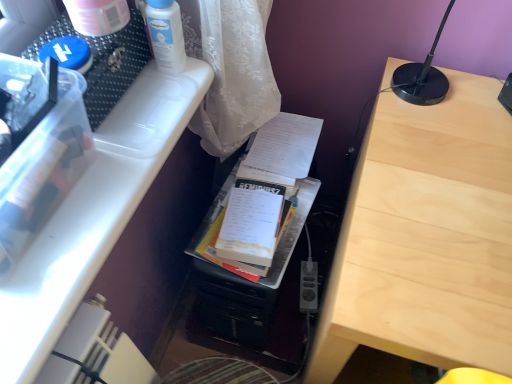
Measure the distance between point (57, 237) and camera.

Point (57, 237) and camera are 55.40 centimeters apart from each other.

Locate an element on the screen. white glossy lotion at upper center is located at coordinates (166, 35).

The image size is (512, 384). Find the location of `light wood table at center`. light wood table at center is located at coordinates coord(426,237).

Is white paper at center turned away from white glossy lotion at upper center?

That's not correct — white paper at center is not looking away from white glossy lotion at upper center.

Where is `bottle to the left of white paper at center`? This screenshot has width=512, height=384. bottle to the left of white paper at center is located at coordinates point(166,35).

Is white glossy lotion at upper center surrounded by white paper at center?

No, white glossy lotion at upper center is not a part of white paper at center.

Considering the sizes of objects white paper at center and white glossy lotion at upper center in the image provided, who is bigger, white paper at center or white glossy lotion at upper center?

With larger size is white glossy lotion at upper center.

In the scene shown: Which is closer to the camera, (x=23, y=330) or (x=294, y=142)?

Point (x=23, y=330).

Does white plastic container at upper left contain white paper at center?

Answer: No.

From the image's perspective, which one is positioned higher, white plastic container at upper left or white paper at center?

white paper at center.

Looking at this image, is white glossy lotion at upper center bigger than white plastic container at upper left?

No.

Considering the relative sizes of white glossy lotion at upper center and white plastic container at upper left in the image provided, is white glossy lotion at upper center shorter than white plastic container at upper left?

Incorrect, the height of white glossy lotion at upper center does not fall short of that of white plastic container at upper left.

Does white glossy lotion at upper center lie behind white plastic container at upper left?

That is True.

Is white glossy lotion at upper center oriented away from white plastic container at upper left?

No, white glossy lotion at upper center is not facing away from white plastic container at upper left.

Consider the image. Is white plastic container at upper left placed right next to white glossy lotion at upper center?

No, white plastic container at upper left is not beside white glossy lotion at upper center.

Where is `desk located below the white glossy lotion at upper center (from the image's perspective)`? The height and width of the screenshot is (384, 512). desk located below the white glossy lotion at upper center (from the image's perspective) is located at coordinates (93, 215).

Who is more distant, white plastic container at upper left or white glossy lotion at upper center?

white glossy lotion at upper center.

Is white plastic container at upper left looking in the opposite direction of white glossy lotion at upper center?

No, white plastic container at upper left's orientation is not away from white glossy lotion at upper center.

Would you say white paper at center is a long distance from light wood table at center?

No, white paper at center is in close proximity to light wood table at center.

Is white paper at center at the left side of light wood table at center?

Yes.

Relative to light wood table at center, is white paper at center in front or behind?

Visually, white paper at center is located behind light wood table at center.

Considering the relative sizes of white paper at center and light wood table at center in the image provided, is white paper at center taller than light wood table at center?

No, white paper at center is not taller than light wood table at center.

Is black plastic power plugs and sockets at lower center positioned far away from white glossy lotion at upper center?

No, black plastic power plugs and sockets at lower center is not far away from white glossy lotion at upper center.

Does black plastic power plugs and sockets at lower center have a larger size compared to white glossy lotion at upper center?

Incorrect, black plastic power plugs and sockets at lower center is not larger than white glossy lotion at upper center.

Considering the sizes of black plastic power plugs and sockets at lower center and white glossy lotion at upper center in the image, is black plastic power plugs and sockets at lower center taller or shorter than white glossy lotion at upper center?

Considering their sizes, black plastic power plugs and sockets at lower center has less height than white glossy lotion at upper center.

Can you tell me how much black plastic power plugs and sockets at lower center and white glossy lotion at upper center differ in facing direction?

The angular difference between black plastic power plugs and sockets at lower center and white glossy lotion at upper center is 77.9 degrees.

Can you tell me how much white paper at center and white plastic container at upper left differ in facing direction?

86.9 degrees separate the facing orientations of white paper at center and white plastic container at upper left.

Considering the sizes of objects white paper at center and white plastic container at upper left in the image provided, who is bigger, white paper at center or white plastic container at upper left?

white plastic container at upper left is bigger.

Is the depth of white paper at center greater than that of white plastic container at upper left?

Yes, white paper at center is behind white plastic container at upper left.

Considering the positions of point (296, 168) and point (59, 298), is point (296, 168) closer or farther from the camera than point (59, 298)?

Point (296, 168) is farther from the camera than point (59, 298).

Locate an element on the screen. document on the right of the white glossy lotion at upper center is located at coordinates (285, 146).

Where is `desk that appears above the white paper at center (from a real-world perspective)`? Image resolution: width=512 pixels, height=384 pixels. desk that appears above the white paper at center (from a real-world perspective) is located at coordinates (93, 215).

From the image, which object appears to be nearer to black plastic power plugs and sockets at lower center, white plastic container at upper left or white glossy lotion at upper center?

white plastic container at upper left lies closer to black plastic power plugs and sockets at lower center than the other object.

When comparing their distances from black plastic power plugs and sockets at lower center, does white glossy lotion at upper center or light wood table at center seem further?

Among the two, white glossy lotion at upper center is located further to black plastic power plugs and sockets at lower center.

Considering their positions, is white plastic container at upper left positioned closer to white paper at center than white glossy lotion at upper center?

Based on the image, white glossy lotion at upper center appears to be nearer to white paper at center.

Considering their positions, is black plastic power plugs and sockets at lower center positioned closer to white paper at center than white plastic container at upper left?

Among the two, white plastic container at upper left is located nearer to white paper at center.

When comparing their distances from white glossy lotion at upper center, does white plastic container at upper left or white paper at center seem further?

white paper at center is further to white glossy lotion at upper center.

Estimate the real-world distances between objects in this image. Which object is further from white paper at center, light wood table at center or white glossy lotion at upper center?

white glossy lotion at upper center lies further to white paper at center than the other object.

Based on the photo, estimate the real-world distances between objects in this image. Which object is closer to light wood table at center, white paper at center or white glossy lotion at upper center?

white paper at center is positioned closer to the anchor light wood table at center.

Estimate the real-world distances between objects in this image. Which object is further from white paper at center, white glossy lotion at upper center or black plastic power plugs and sockets at lower center?

Based on the image, black plastic power plugs and sockets at lower center appears to be further to white paper at center.

The height and width of the screenshot is (384, 512). I want to click on bottle between white plastic container at upper left and white paper at center along the z-axis, so click(166, 35).

This screenshot has height=384, width=512. Find the location of `bottle between light wood table at center and black plastic power plugs and sockets at lower center in the front-back direction`. bottle between light wood table at center and black plastic power plugs and sockets at lower center in the front-back direction is located at coordinates (166, 35).

Find the location of a particular element. document between white plastic container at upper left and black plastic power plugs and sockets at lower center in the front-back direction is located at coordinates (285, 146).

Find the location of a particular element. document situated between white glossy lotion at upper center and light wood table at center from left to right is located at coordinates (285, 146).